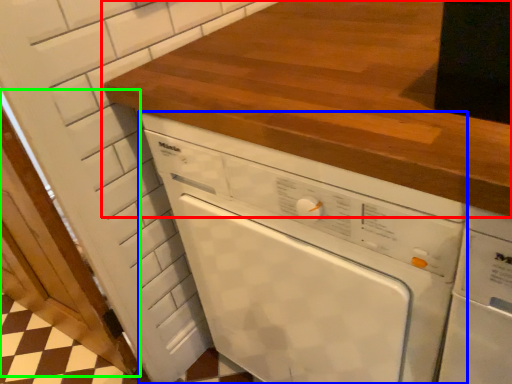
Question: Which is farther away from countertop (highlighted by a red box)? home appliance (highlighted by a blue box) or door (highlighted by a green box)?

Choices:
 (A) home appliance
 (B) door

Answer: (B)